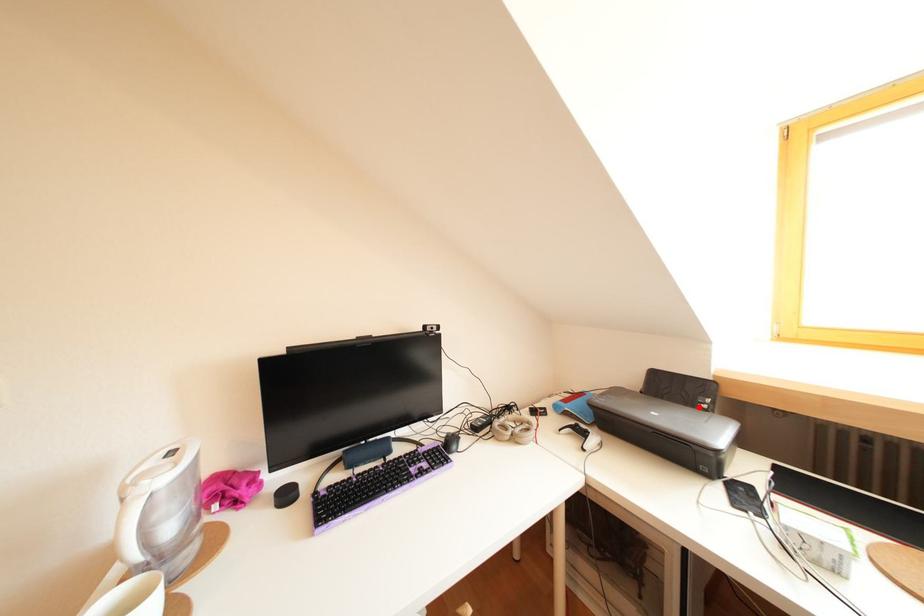
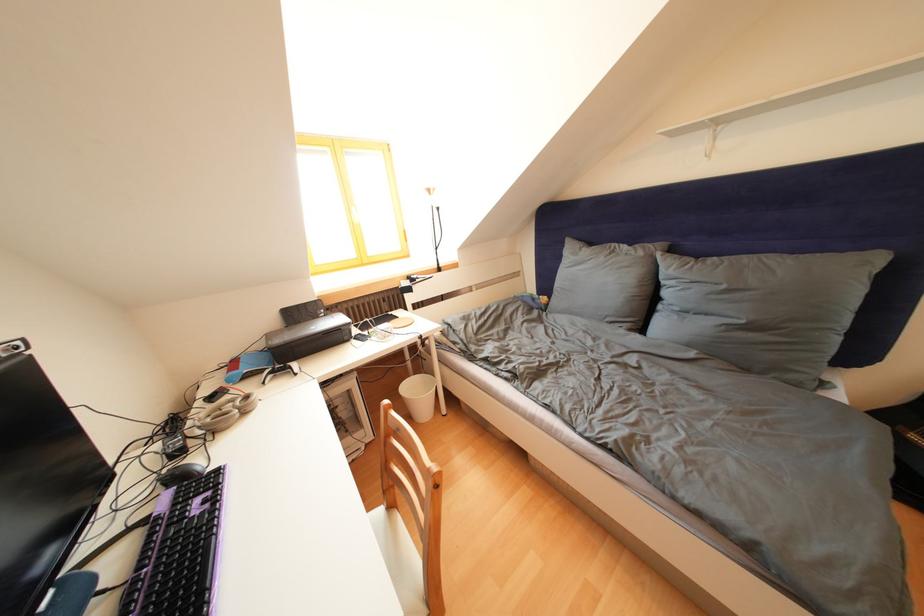
Question: I am providing you with two images of the same scene from different viewpoints. A red point is shown in image1. For the corresponding object point in image2, is it positioned nearer or farther from the camera?

Choices:
 (A) Nearer
 (B) Farther

Answer: (A)